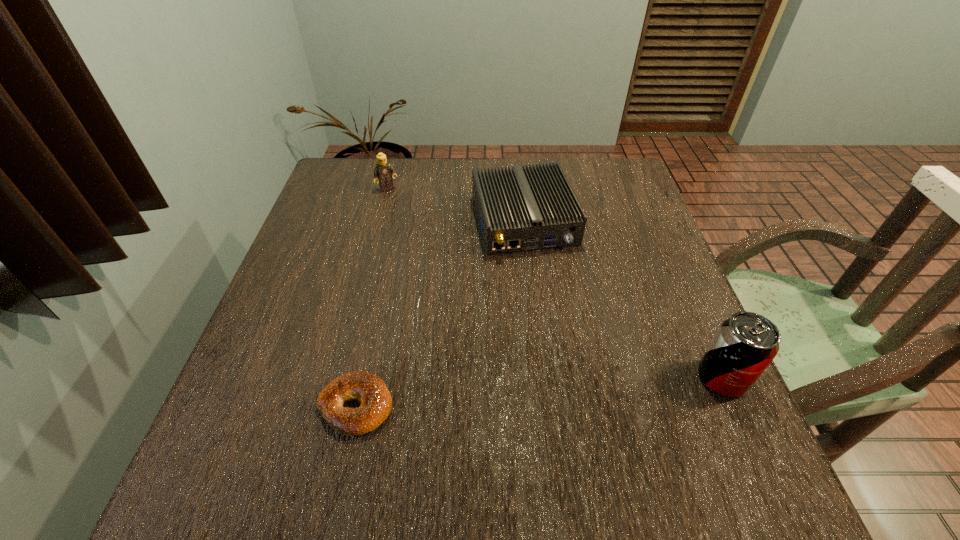
Where is `free space that satisfies the following two spatial constraints: 1. on the back side of the rightmost object; 2. on the left side of the shortest object`? This screenshot has height=540, width=960. free space that satisfies the following two spatial constraints: 1. on the back side of the rightmost object; 2. on the left side of the shortest object is located at coordinates (362, 377).